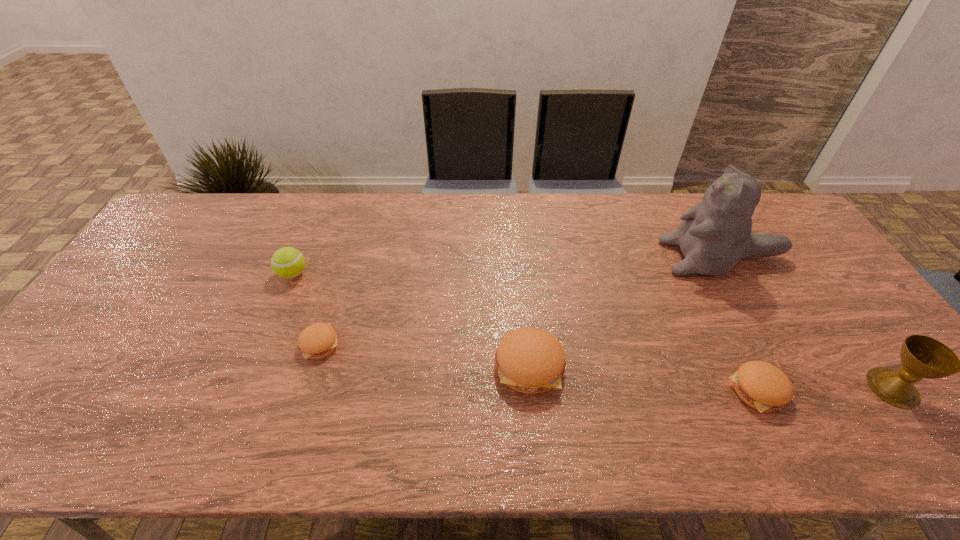
Locate an element on the screen. This screenshot has width=960, height=540. the shortest patty is located at coordinates (316, 341).

Locate an element on the screen. the second object from left to right is located at coordinates (316, 341).

You are a GUI agent. You are given a task and a screenshot of the screen. Output one action in this format:
    pyautogui.click(x=<x>, y=<y>)
    Task: Click on the second patty from right to left
    Image resolution: width=960 pixels, height=540 pixels.
    Given the screenshot: What is the action you would take?
    pyautogui.click(x=530, y=360)

At what (x,y) coordinates should I click in order to perform the action: click on the third object from left to right. Please return your answer as a coordinate pair (x, y). This screenshot has height=540, width=960. Looking at the image, I should click on (530, 360).

What are the coordinates of `the second tallest patty` in the screenshot? It's located at [x=761, y=385].

In order to click on the second shortest object in this screenshot , I will do `click(761, 385)`.

Locate an element on the screen. The image size is (960, 540). the tallest object is located at coordinates (715, 234).

Where is `the leftmost object`? This screenshot has height=540, width=960. the leftmost object is located at coordinates (287, 262).

Locate an element on the screen. Image resolution: width=960 pixels, height=540 pixels. chalice is located at coordinates (922, 357).

I want to click on free point located on the right of the shortest object, so click(471, 344).